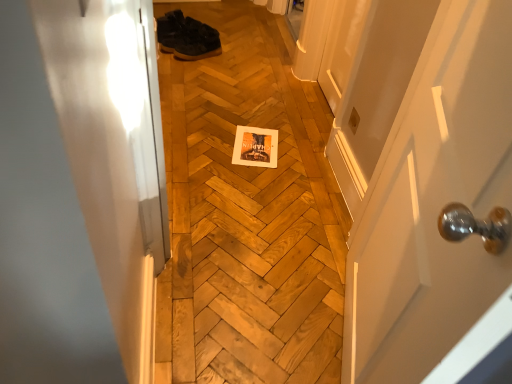
Question: Is dark brown leather shoes at upper center not near white glossy door at center?

Choices:
 (A) no
 (B) yes

Answer: (B)

Question: From a real-world perspective, is dark brown leather shoes at upper center positioned over white glossy door at center based on gravity?

Choices:
 (A) yes
 (B) no

Answer: (B)

Question: Does dark brown leather shoes at upper center have a larger size compared to white glossy door at center?

Choices:
 (A) no
 (B) yes

Answer: (A)

Question: Does dark brown leather shoes at upper center come in front of white glossy door at center?

Choices:
 (A) no
 (B) yes

Answer: (A)

Question: From a real-world perspective, is dark brown leather shoes at upper center located beneath white glossy door at center?

Choices:
 (A) no
 (B) yes

Answer: (B)

Question: From the image's perspective, relative to dark brown leather shoes at upper center, is wooden at center above or below?

Choices:
 (A) above
 (B) below

Answer: (B)

Question: Is wooden at center bigger or smaller than dark brown leather shoes at upper center?

Choices:
 (A) small
 (B) big

Answer: (B)

Question: In the image, is wooden at center positioned in front of or behind dark brown leather shoes at upper center?

Choices:
 (A) behind
 (B) front

Answer: (B)

Question: In terms of width, does wooden at center look wider or thinner when compared to dark brown leather shoes at upper center?

Choices:
 (A) wide
 (B) thin

Answer: (A)

Question: Is point (364, 273) positioned closer to the camera than point (187, 41)?

Choices:
 (A) farther
 (B) closer

Answer: (B)

Question: Based on their positions, is white glossy door at center located to the left or right of dark brown leather shoes at upper center?

Choices:
 (A) left
 (B) right

Answer: (B)

Question: From the image's perspective, is white glossy door at center located above or below dark brown leather shoes at upper center?

Choices:
 (A) below
 (B) above

Answer: (A)

Question: Relative to dark brown leather shoes at upper center, is white glossy door at center in front or behind?

Choices:
 (A) front
 (B) behind

Answer: (A)

Question: Relative to wooden at center, is dark brown leather shoes at upper center in front or behind?

Choices:
 (A) behind
 (B) front

Answer: (A)

Question: Considering the positions of point (204, 38) and point (240, 274), is point (204, 38) closer or farther from the camera than point (240, 274)?

Choices:
 (A) closer
 (B) farther

Answer: (B)